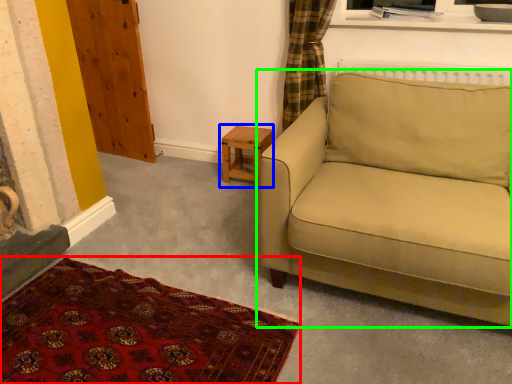
Question: Which is farther away from plain (highlighted by a red box)? table (highlighted by a blue box) or studio couch (highlighted by a green box)?

Choices:
 (A) table
 (B) studio couch

Answer: (A)